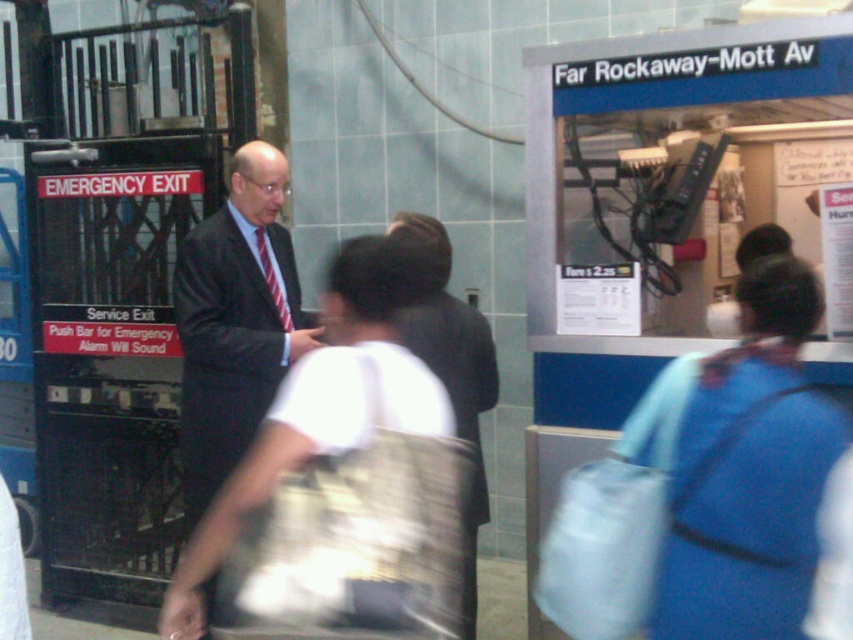
You are a subway worker who needs to retrieve the blue fabric bag at center. You are currently standing next to the dark suit at left. The bag is on a bench. Can you reach it without moving more than 1.5 meters?

The distance between the blue fabric bag at center and the dark suit at left is 1.52 meters. Since the required distance to move is more than 1.5 meters, you cannot reach the bag without moving beyond the specified limit.

You are at the Far Rockaway Mott Avenue subway station and need to locate two specific points marked on a map. The first point is at coordinates point (767, 452) and the second is at point (341, 426). From your current position, which point is closer to you?

Point (341, 426) is closer to you because it is in front of point (767, 452) according to the spatial relationship provided.

You are a subway passenger holding a white fabric bag at center and wearing a dark suit at left. You need to place the bag on a shelf that can only hold items smaller than your clothing. Can the bag fit on the shelf?

The white fabric bag at center is smaller than the dark suit at left, so it can fit on the shelf since the shelf requires items to be smaller than the clothing you are wearing.